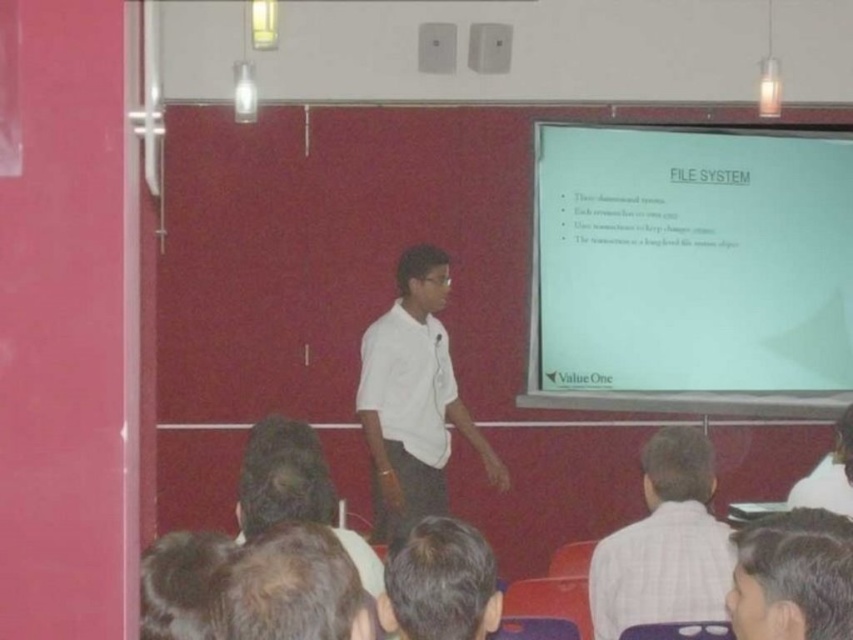
Which is in front, point (416, 444) or point (844, 636)?

Positioned in front is point (844, 636).

Who is more forward, (445,346) or (744,532)?

Point (744,532) is in front.

Where is `white matte shirt at center`? The image size is (853, 640). white matte shirt at center is located at coordinates [x=413, y=397].

Does white matte projection screen at upper right appear on the left side of dark brown hair at lower right?

No, white matte projection screen at upper right is not to the left of dark brown hair at lower right.

Is white matte projection screen at upper right to the right of dark brown hair at lower right from the viewer's perspective?

Correct, you'll find white matte projection screen at upper right to the right of dark brown hair at lower right.

This screenshot has height=640, width=853. Find the location of `white matte projection screen at upper right`. white matte projection screen at upper right is located at coordinates (691, 269).

Between white matte projection screen at upper right and dark brown hair at center, which one has more height?

Standing taller between the two is white matte projection screen at upper right.

Does white matte projection screen at upper right have a smaller size compared to dark brown hair at center?

No.

Is point (577, 198) behind point (453, 570)?

Yes, it is behind point (453, 570).

The image size is (853, 640). What are the coordinates of `white matte projection screen at upper right` in the screenshot? It's located at (691, 269).